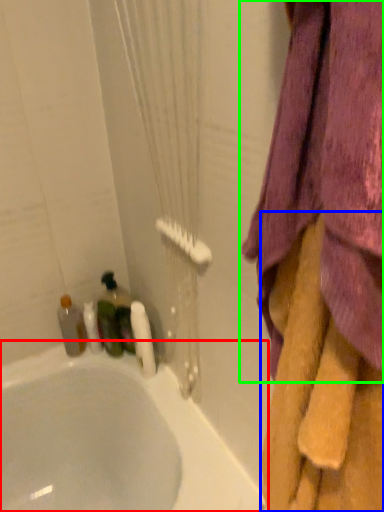
Question: Estimate the real-world distances between objects in this image. Which object is farther from bathtub (highlighted by a red box), towel (highlighted by a blue box) or curtain (highlighted by a green box)?

Choices:
 (A) towel
 (B) curtain

Answer: (B)